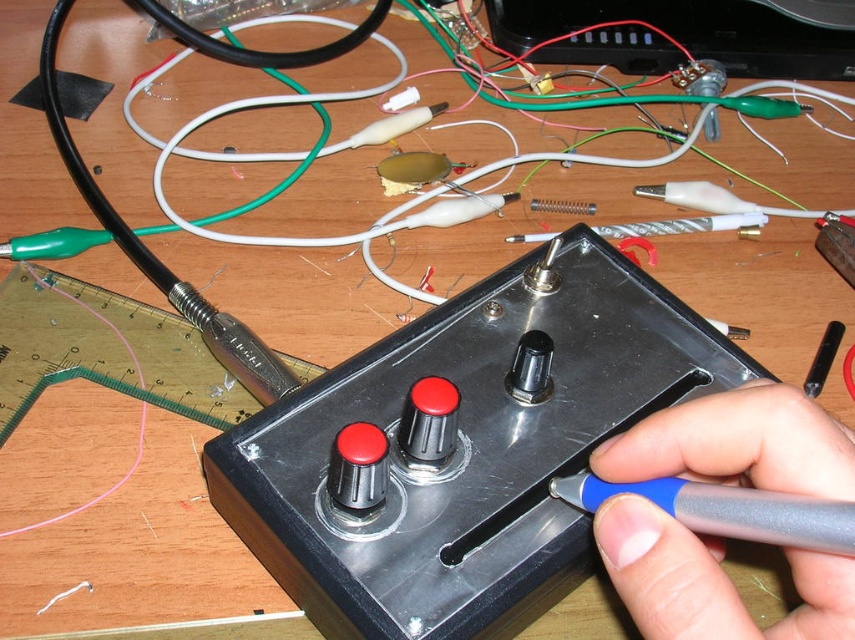
Between black metallic control panel at center and gray plastic pen at center, which one is positioned lower?

gray plastic pen at center

Is point (497, 461) positioned after point (765, 636)?

Yes, it is behind point (765, 636).

Locate an element on the screen. black metallic control panel at center is located at coordinates (463, 448).